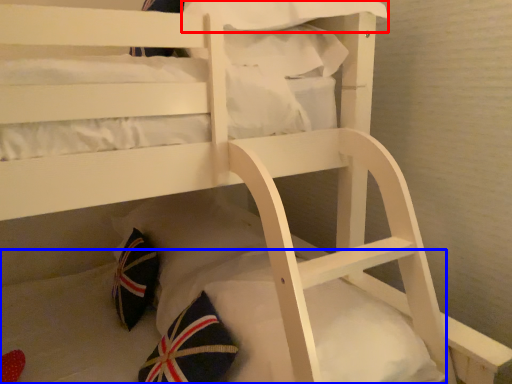
Question: Which point is closer to the camera, pillow (highlighted by a red box) or mattress (highlighted by a blue box)?

Choices:
 (A) pillow
 (B) mattress

Answer: (B)